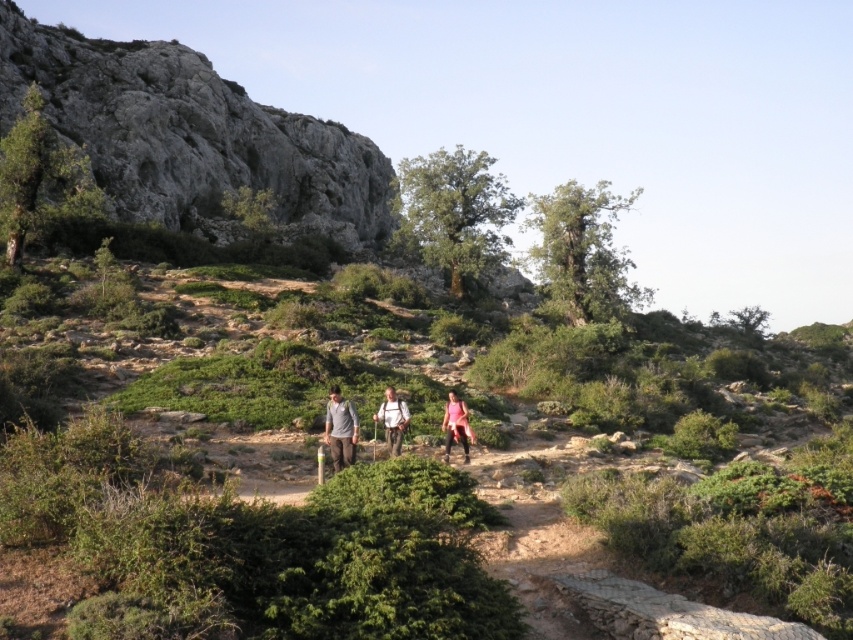
You are a hiker trying to navigate the rugged terrain. You see the rugged stone hillside at upper left and the light brown leather backpack at center. Which object is higher up in the scene?

The rugged stone hillside at upper left is above the light brown leather backpack at center, so it is higher up in the scene.

You are a hiker trying to navigate through the rugged terrain. You see the rugged stone hillside at upper left and the light brown leather backpack at center. Which object is located to the left of the other?

The rugged stone hillside at upper left is positioned on the left side of light brown leather backpack at center, so the rugged stone hillside at upper left is to the left of the light brown leather backpack at center.

You are a hiker trying to decide which of the two items at the center of the trail to step over first. The items are the matte gray pants at center and the pink fabric at center. Based on their widths, which one should you choose to step over first?

The matte gray pants at center is narrower than the pink fabric at center, so you should step over the matte gray pants at center first since it requires less space to navigate around.